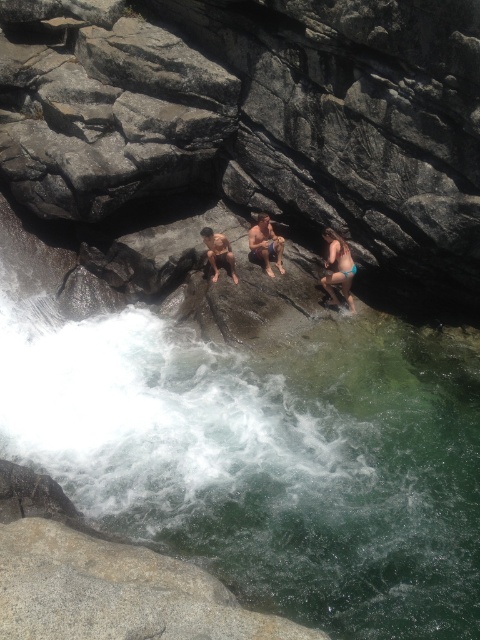
Find the location of a particular element. teal bikini bottom at lower right is located at coordinates (338, 268).

Based on the photo, measure the distance from teal bikini bottom at lower right to smooth tan skin at center.

1.51 meters

Where is `teal bikini bottom at lower right`? teal bikini bottom at lower right is located at coordinates tap(338, 268).

Is tan skin human at center wider than smooth tan skin at center?

Yes, tan skin human at center is wider than smooth tan skin at center.

Is tan skin human at center taller than smooth tan skin at center?

Correct, tan skin human at center is much taller as smooth tan skin at center.

Is point (277, 260) in front of point (215, 237)?

That is False.

Find the location of a particular element. Image resolution: width=480 pixels, height=640 pixels. tan skin human at center is located at coordinates (265, 243).

Can you confirm if clear water at center is positioned to the left of tan skin human at center?

Indeed, clear water at center is positioned on the left side of tan skin human at center.

Who is positioned more to the right, clear water at center or tan skin human at center?

From the viewer's perspective, tan skin human at center appears more on the right side.

Does point (264, 490) come closer to viewer compared to point (275, 236)?

That is True.

The width and height of the screenshot is (480, 640). What are the coordinates of `clear water at center` in the screenshot? It's located at coord(266,460).